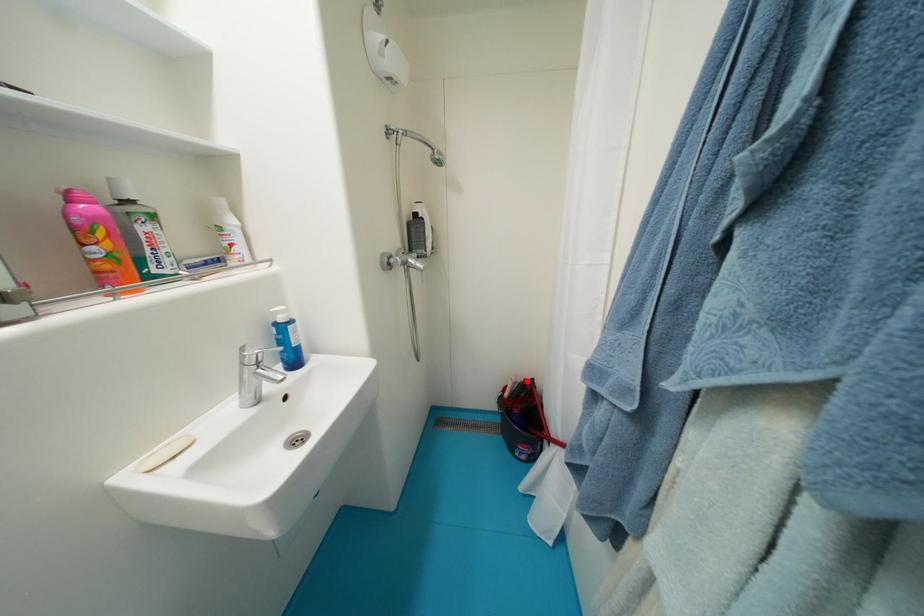
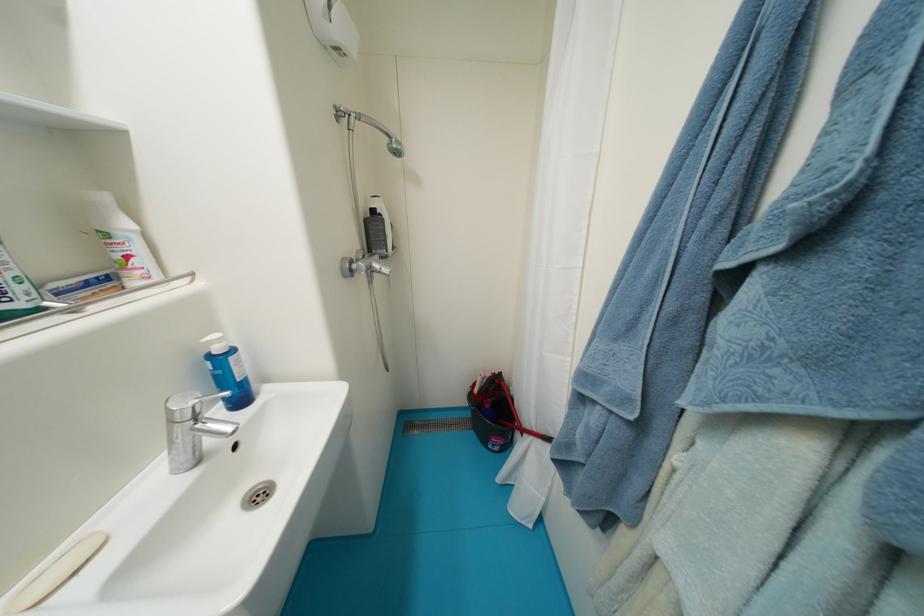
Find the pixel in the second image that matches the highlighted location in the first image.

(495, 377)